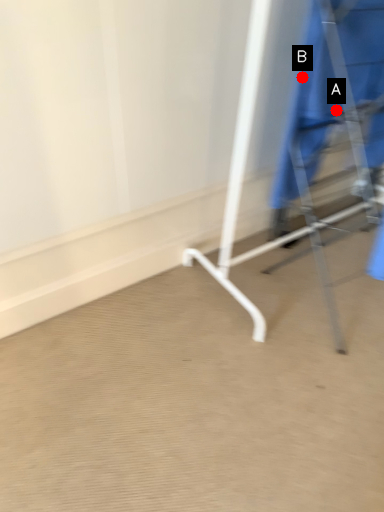
Question: Two points are circled on the image, labeled by A and B beside each circle. Which point appears closest to the camera in this image?

Choices:
 (A) A is closer
 (B) B is closer

Answer: (A)